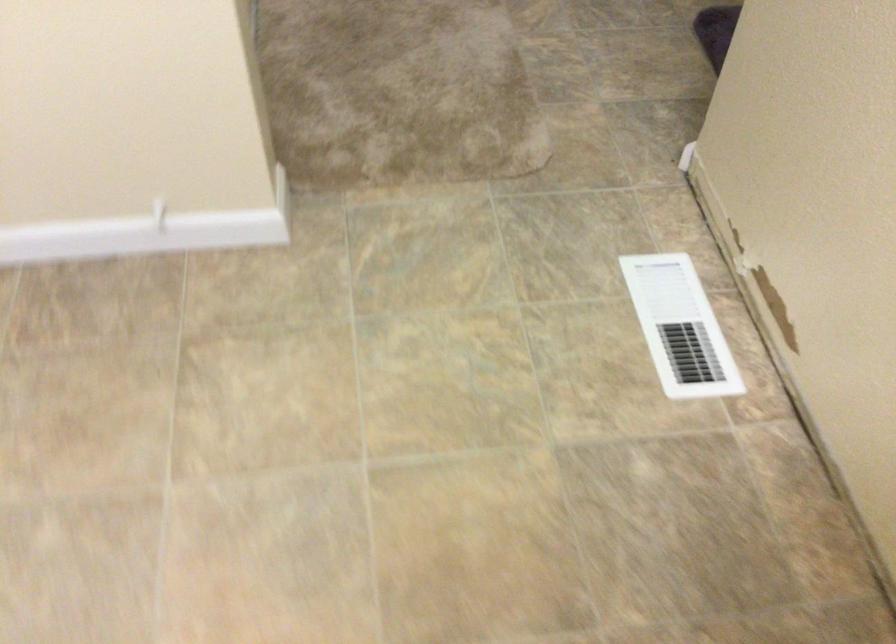
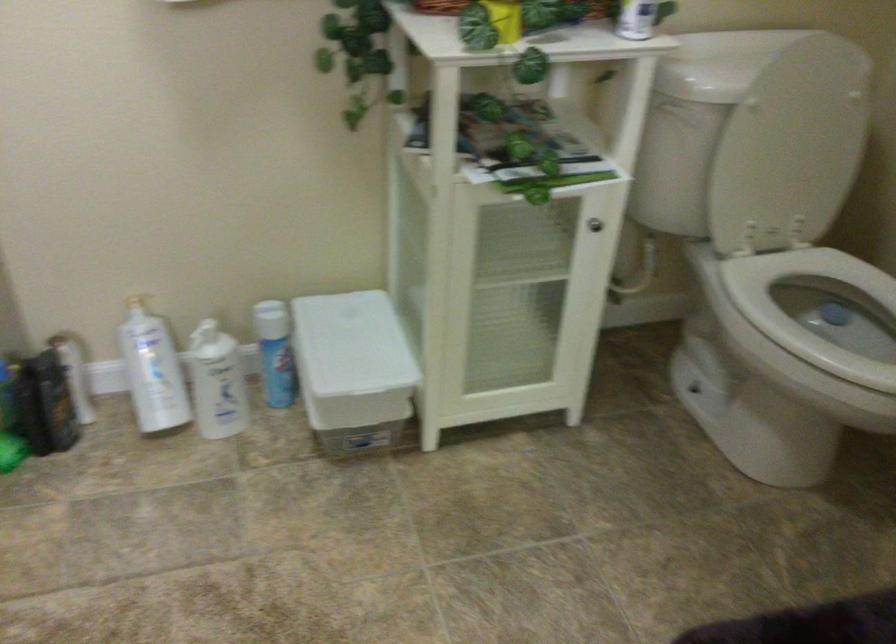
Question: In a continuous first-person perspective shot, in which direction is the camera moving?

Choices:
 (A) Left
 (B) Right
 (C) Forward
 (D) Backward

Answer: (C)